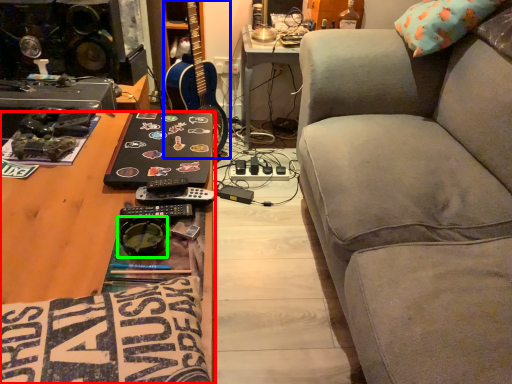
Question: Which is nearer to the desk (highlighted by a red box)? guitar (highlighted by a blue box) or goggles (highlighted by a green box).

Choices:
 (A) guitar
 (B) goggles

Answer: (B)